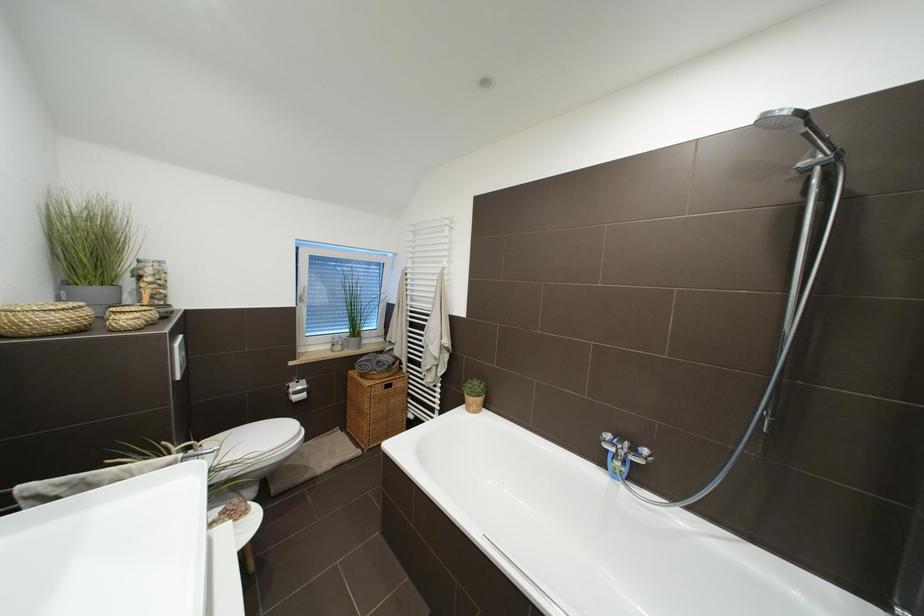
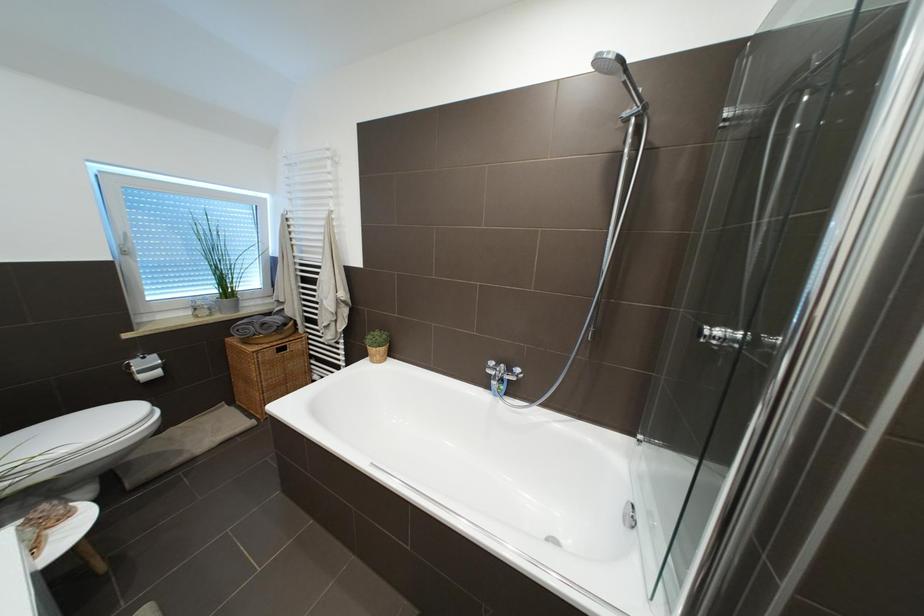
Question: What movement of the cameraman would produce the second image?

Choices:
 (A) Left
 (B) Right
 (C) Forward
 (D) Backward

Answer: (B)